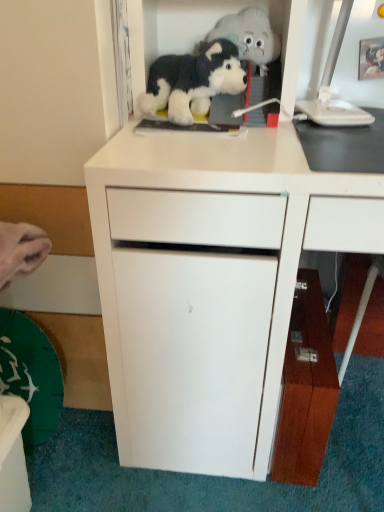
Where is `vacant space in front of wooden cabinet at lower right, arranged as the 1th cabinetry when viewed from the right`? The width and height of the screenshot is (384, 512). vacant space in front of wooden cabinet at lower right, arranged as the 1th cabinetry when viewed from the right is located at coordinates (310, 482).